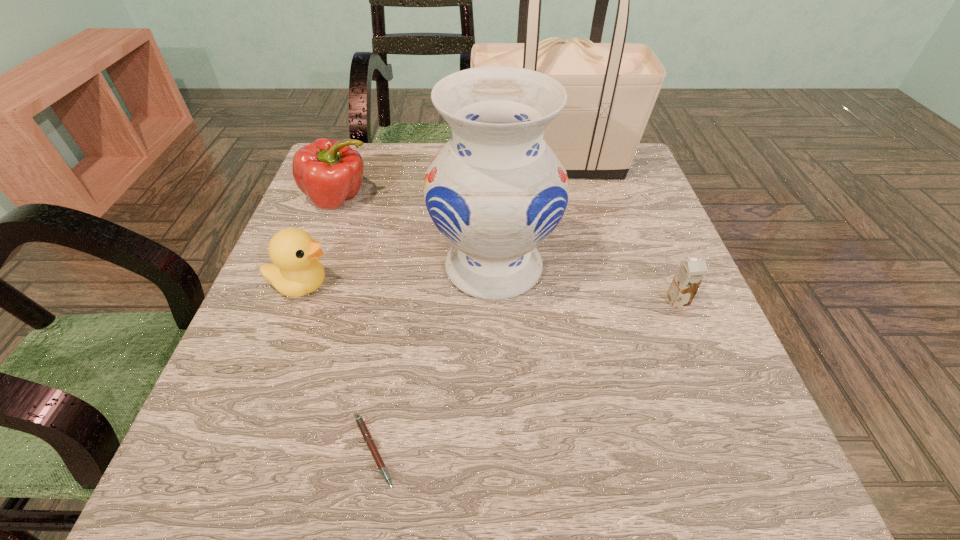
Identify the location of shopping bag. (611, 88).

Identify the location of the fifth shortest object. (496, 190).

This screenshot has width=960, height=540. What are the coordinates of `pepper` in the screenshot? It's located at (329, 172).

Where is `the third shortest object`? Image resolution: width=960 pixels, height=540 pixels. the third shortest object is located at coordinates (295, 271).

Locate an element on the screen. chocolate milk is located at coordinates (691, 272).

The width and height of the screenshot is (960, 540). I want to click on the third object from left to right, so click(x=362, y=426).

You are a GUI agent. You are given a task and a screenshot of the screen. Output one action in this format:
    pyautogui.click(x=<x>, y=<y>)
    Task: Click on the nearest object
    This screenshot has height=540, width=960.
    Given the screenshot: What is the action you would take?
    pyautogui.click(x=362, y=426)

Find the location of a particular element. vacant space positioned 0.160m with handles facing forward on the shopping bag is located at coordinates point(411,164).

I want to click on free space located with handles facing forward on the shopping bag, so click(x=335, y=164).

The height and width of the screenshot is (540, 960). In order to click on vacant space located with handles facing forward on the shopping bag in this screenshot , I will do `click(381, 164)`.